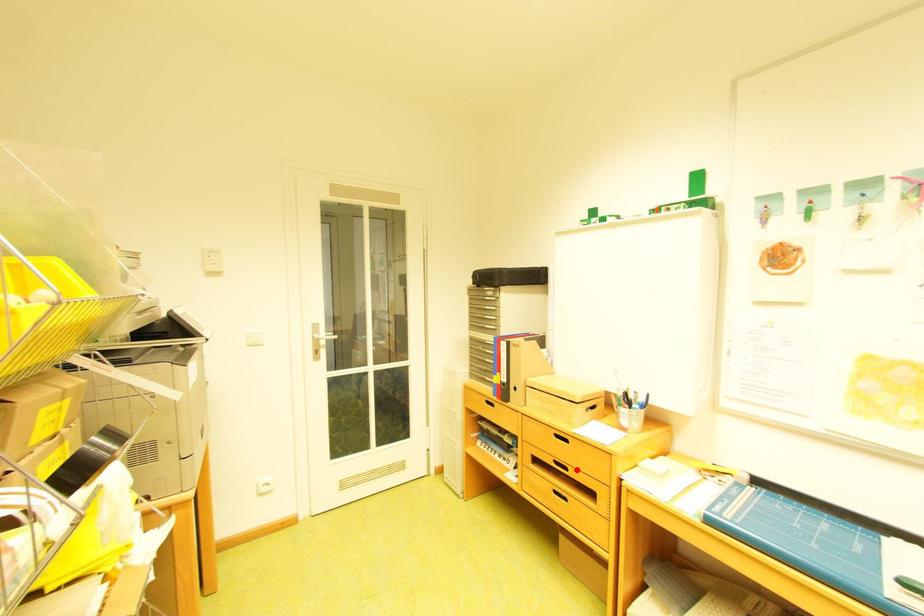
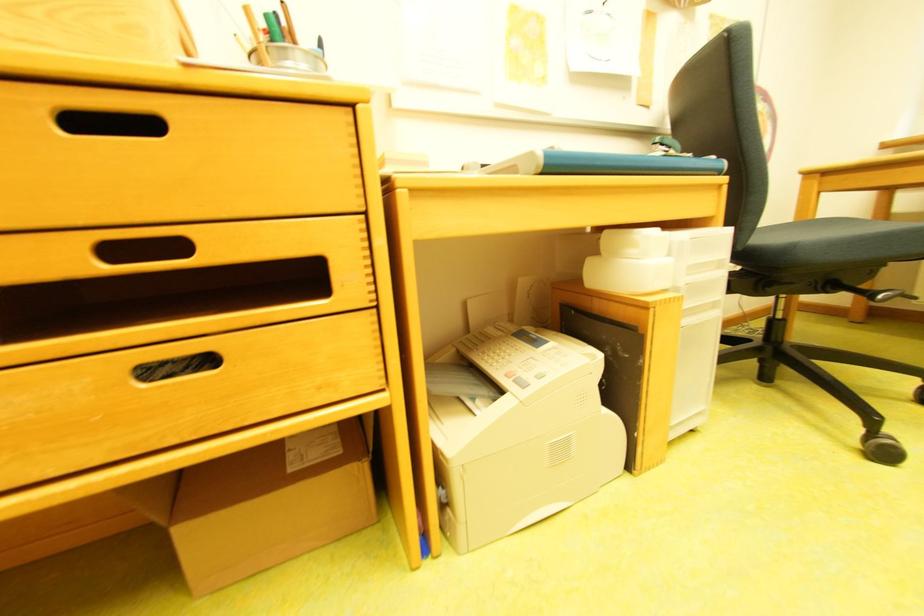
The point at the highlighted location is marked in the first image. Where is the corresponding point in the second image?

(189, 246)